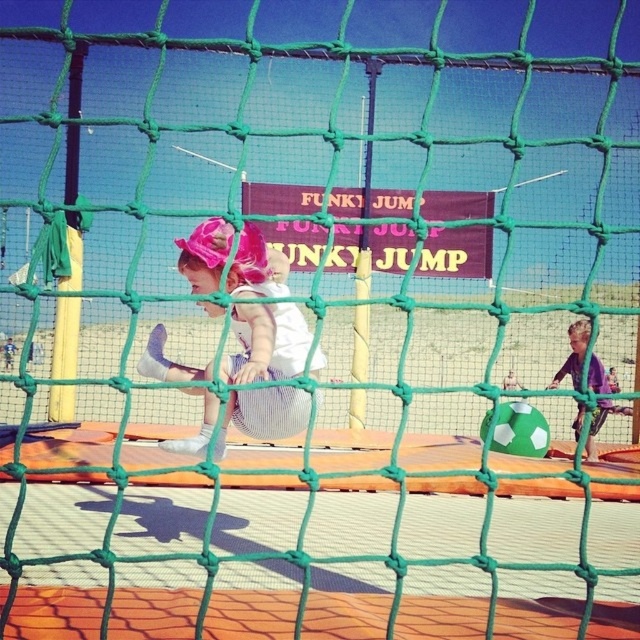
You are standing at the green safety net looking towards the trampoline. There are two points marked on the trampoline area at coordinates point (200, 448) and point (579, 372). Which point is closer to you?

Point (200, 448) is closer to the viewer than point (579, 372).

You are a photographer trying to capture both the pink fabric hat at upper left and the purple matte shirt at right in the same frame. Which object should you focus on first to ensure both are in the frame?

The pink fabric hat at upper left is bigger than the purple matte shirt at right, so you should focus on the pink fabric hat at upper left first to ensure both are in the frame.